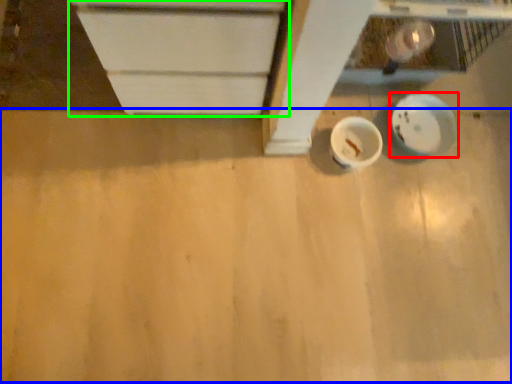
Question: Estimate the real-world distances between objects in this image. Which object is farther from plate (highlighted by a red box), plywood (highlighted by a blue box) or cabinetry (highlighted by a green box)?

Choices:
 (A) plywood
 (B) cabinetry

Answer: (B)